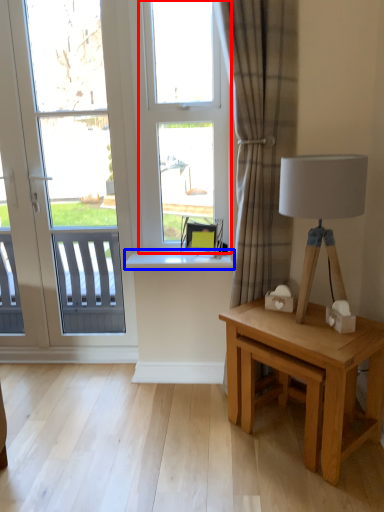
Question: Which of the following is the closest to the observer, bay window (highlighted by a red box) or window sill (highlighted by a blue box)?

Choices:
 (A) bay window
 (B) window sill

Answer: (A)